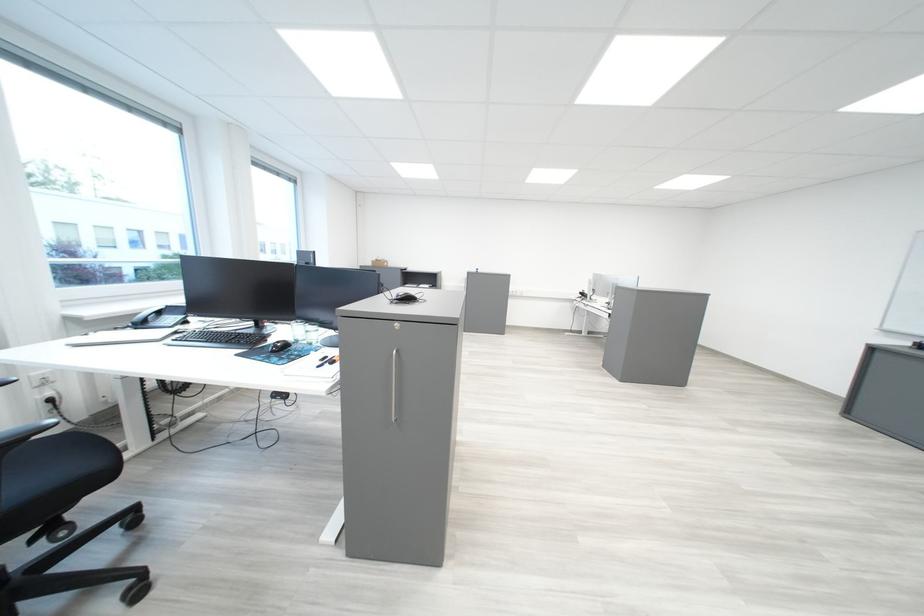
Describe the element at coordinates (23, 432) in the screenshot. I see `a black chair armrest` at that location.